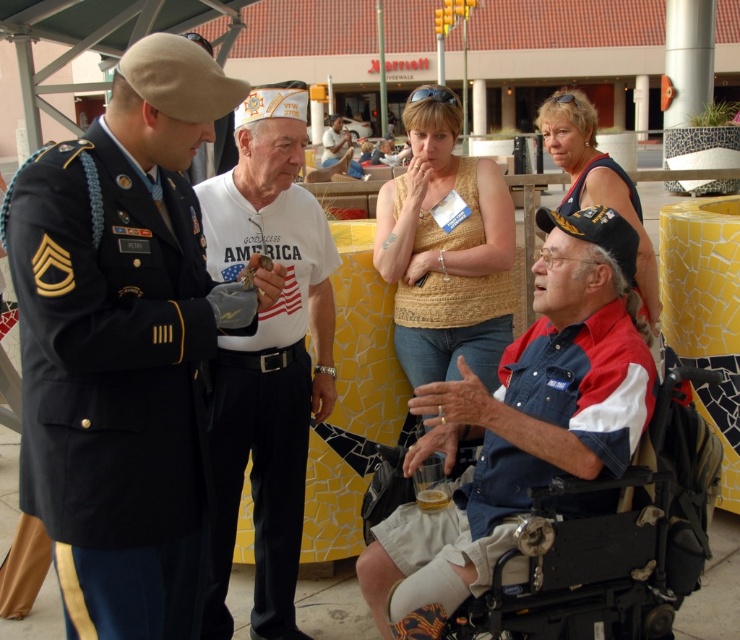
What is located at the coordinates point [445,248]?

The beige textured tank top at center is located at point [445,248].